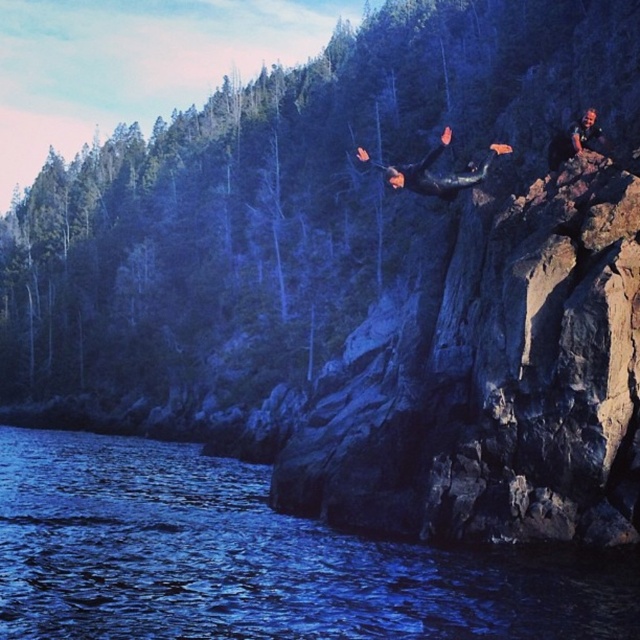
Is blue liquid water at lower left thinner than black matte wetsuit at center?

In fact, blue liquid water at lower left might be wider than black matte wetsuit at center.

Describe the element at coordinates (253, 560) in the screenshot. I see `blue liquid water at lower left` at that location.

Which is in front, point (45, 618) or point (432, 173)?

Point (45, 618) is in front.

At what (x,y) coordinates should I click in order to perform the action: click on blue liquid water at lower left. Please return your answer as a coordinate pair (x, y). The height and width of the screenshot is (640, 640). Looking at the image, I should click on [253, 560].

Which is more to the left, black matte wetsuit at center or camouflage fabric diver at upper right?

black matte wetsuit at center

Is black matte wetsuit at center positioned in front of camouflage fabric diver at upper right?

No, black matte wetsuit at center is further to the viewer.

Does point (426, 176) lie behind point (573, 147)?

That is True.

You are a GUI agent. You are given a task and a screenshot of the screen. Output one action in this format:
    pyautogui.click(x=<x>, y=<y>)
    Task: Click on the black matte wetsuit at center
    The image size is (640, 640).
    Given the screenshot: What is the action you would take?
    pyautogui.click(x=436, y=173)

Which is more to the right, blue liquid water at lower left or camouflage fabric diver at upper right?

From the viewer's perspective, camouflage fabric diver at upper right appears more on the right side.

Can you confirm if blue liquid water at lower left is taller than camouflage fabric diver at upper right?

No.

Is point (49, 636) farther from camera compared to point (564, 132)?

That is False.

Locate an element on the screen. The width and height of the screenshot is (640, 640). blue liquid water at lower left is located at coordinates (253, 560).